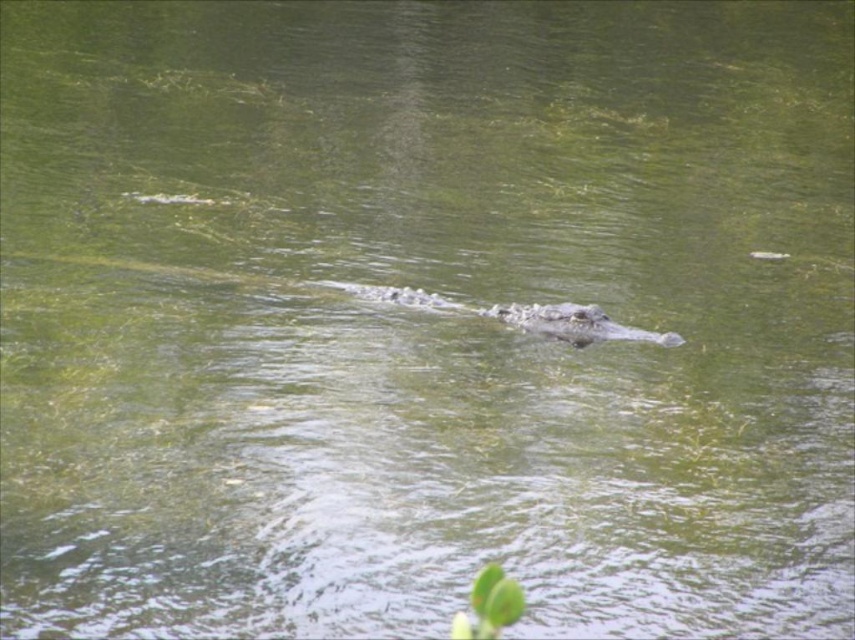
Can you confirm if dark gray textured crocodile at center is positioned above dark green scaly crocodile at center?

Indeed, dark gray textured crocodile at center is positioned over dark green scaly crocodile at center.

The height and width of the screenshot is (640, 855). What do you see at coordinates (523, 316) in the screenshot? I see `dark gray textured crocodile at center` at bounding box center [523, 316].

Between point (381, 288) and point (546, 305), which one is positioned behind?

Point (381, 288)

What are the coordinates of `dark gray textured crocodile at center` in the screenshot? It's located at (523, 316).